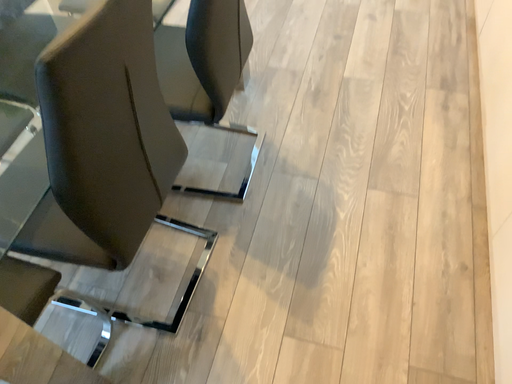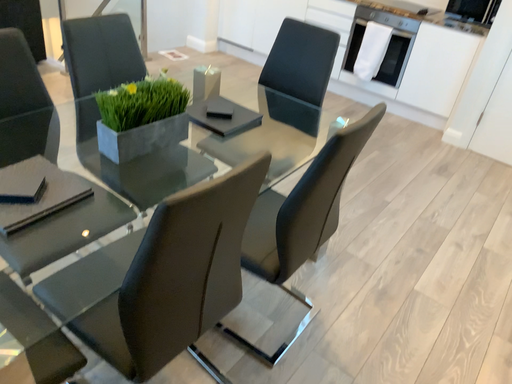
Question: Which way did the camera rotate in the video?

Choices:
 (A) rotated downward
 (B) rotated upward

Answer: (B)